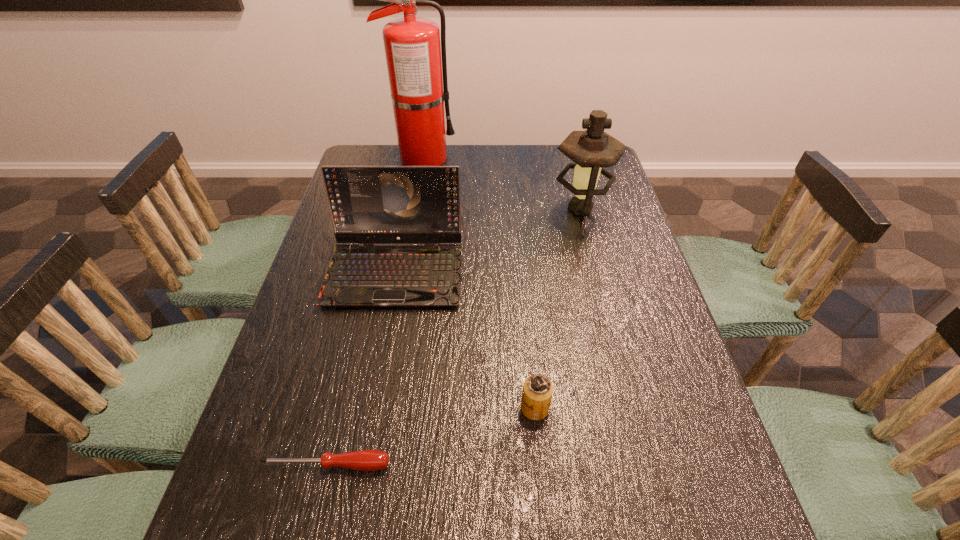
The image size is (960, 540). Identify the location of free space located at the nozzle of the fire extinguisher. (549, 158).

At what (x,y) coordinates should I click in order to perform the action: click on blank space located on the back of the oil lamp. Please return your answer as a coordinate pair (x, y). Looking at the image, I should click on (566, 153).

Where is `vacant space situated 0.200m on the screen of the third tallest object`? The width and height of the screenshot is (960, 540). vacant space situated 0.200m on the screen of the third tallest object is located at coordinates (374, 382).

Identify the location of free space located on the front of the second shortest object. This screenshot has height=540, width=960. (546, 527).

Locate an element on the screen. The height and width of the screenshot is (540, 960). vacant space located 0.210m on the back of the screwdriver is located at coordinates (351, 360).

Identify the location of object positioned at the far edge. This screenshot has height=540, width=960. (413, 52).

Identify the location of fire extinguisher located in the left edge section of the desktop. This screenshot has height=540, width=960. (413, 52).

Where is `laptop computer that is at the left edge`? Image resolution: width=960 pixels, height=540 pixels. laptop computer that is at the left edge is located at coordinates (369, 205).

This screenshot has width=960, height=540. Find the location of `screwdriver present at the left edge`. screwdriver present at the left edge is located at coordinates (364, 460).

The width and height of the screenshot is (960, 540). Find the location of `object present at the right edge`. object present at the right edge is located at coordinates (592, 150).